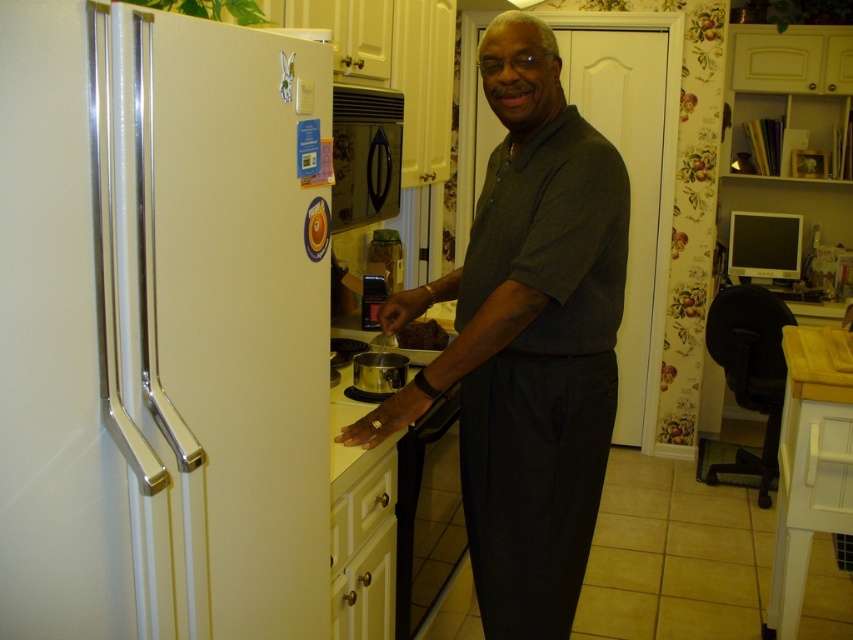
Question: Which point appears farthest from the camera in this image?

Choices:
 (A) (402, 346)
 (B) (784, 228)

Answer: (B)

Question: Can you confirm if dark gray shirt at center is wider than satin silver pot at center?

Choices:
 (A) no
 (B) yes

Answer: (B)

Question: Does white matte refrigerator at left have a lesser width compared to brown matte cake at center?

Choices:
 (A) yes
 (B) no

Answer: (B)

Question: Among these objects, which one is farthest from the camera?

Choices:
 (A) white matte refrigerator at left
 (B) brown matte cake at center
 (C) satin silver pot at center
 (D) dark gray shirt at center

Answer: (B)

Question: Is satin silver pot at center closer to camera compared to brown matte cake at center?

Choices:
 (A) no
 (B) yes

Answer: (B)

Question: Which point is farther to the camera?

Choices:
 (A) satin silver pot at center
 (B) dark gray shirt at center
 (C) white matte refrigerator at left

Answer: (A)